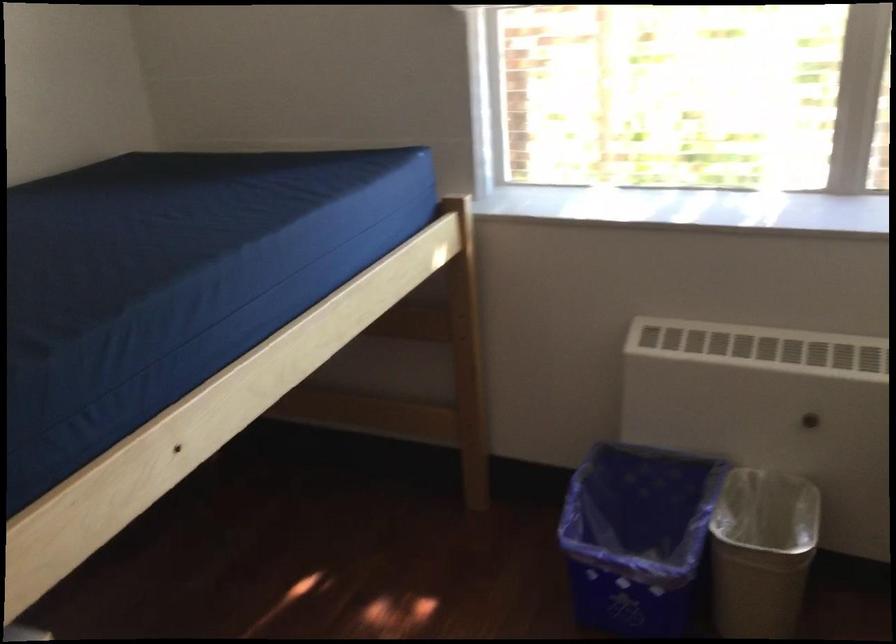
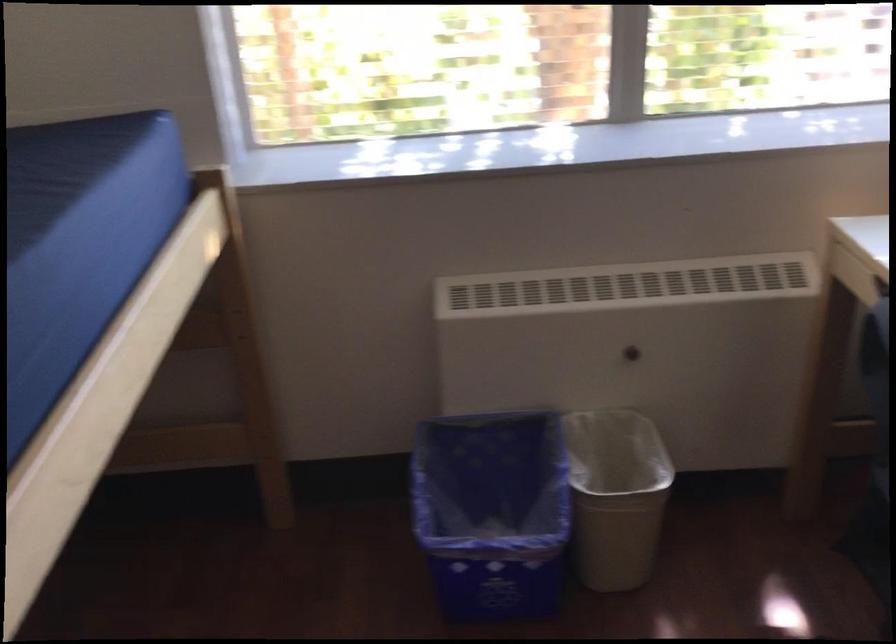
Question: The images are taken continuously from a first-person perspective. In which direction is your viewpoint rotating?

Choices:
 (A) Left
 (B) Right
 (C) Up
 (D) Down

Answer: (B)